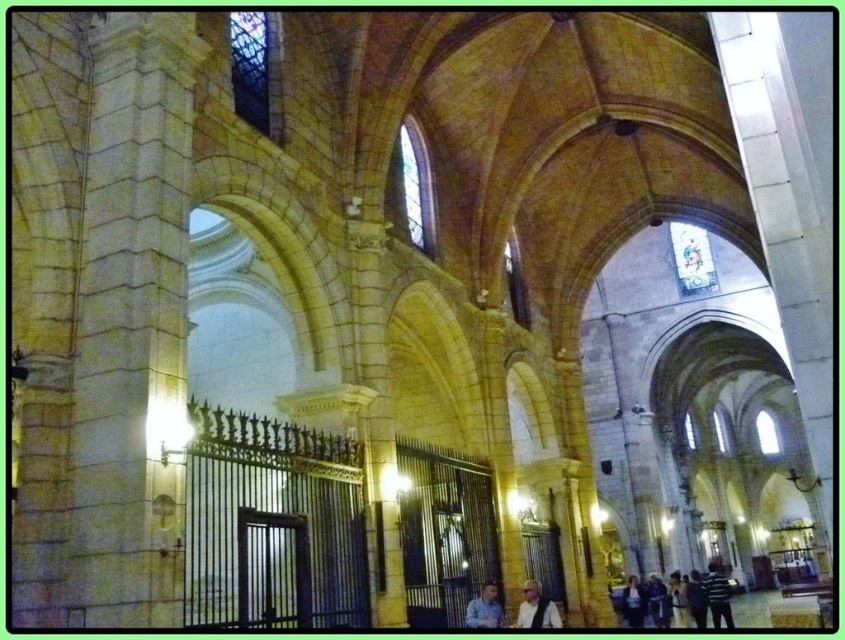
Question: Can you confirm if light brown leather jacket at lower center is wider than dark blue jeans at lower right?

Choices:
 (A) no
 (B) yes

Answer: (A)

Question: Which is farther from the dark blue jeans at lower right?

Choices:
 (A) striped sweater at center
 (B) light brown leather jacket at lower center

Answer: (B)

Question: Which of the following is the farthest from the observer?

Choices:
 (A) dark blue jeans at lower right
 (B) dark blue jacket at lower right
 (C) dark blue shirt at lower right

Answer: (A)

Question: Is striped sweater at center bigger than dark blue jacket at lower right?

Choices:
 (A) yes
 (B) no

Answer: (A)

Question: Which object appears farthest from the camera in this image?

Choices:
 (A) dark blue jacket at lower right
 (B) dark blue shirt at lower right
 (C) blue shirt at center
 (D) striped sweater at center

Answer: (A)

Question: Can you confirm if striped sweater at center is wider than dark blue shirt at lower right?

Choices:
 (A) yes
 (B) no

Answer: (A)